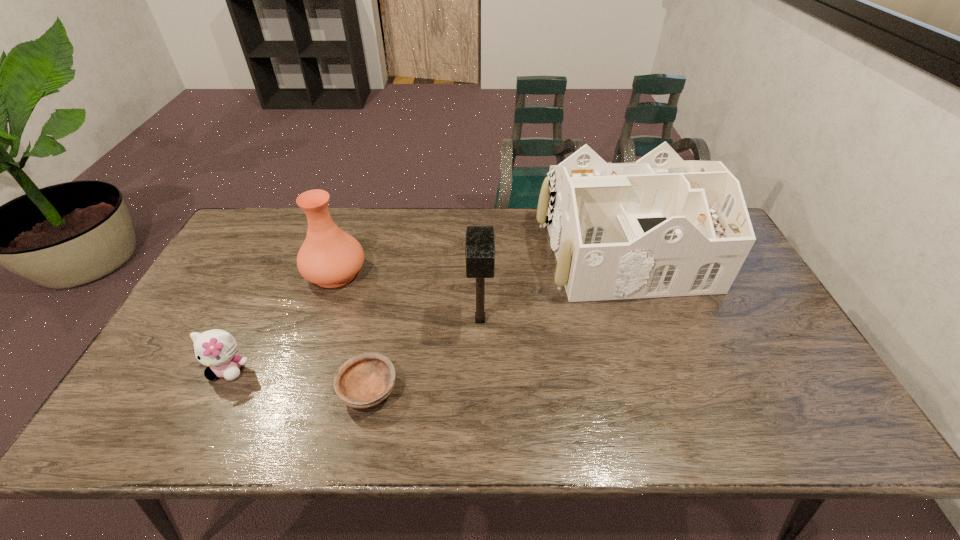
The image size is (960, 540). Identify the location of vacant space situated 0.140m on the back of the fourth object from right to left. (351, 225).

Identify the location of vacant space located on the front-facing side of the fourth tallest object. This screenshot has height=540, width=960. (192, 444).

The width and height of the screenshot is (960, 540). Identify the location of free space located on the right of the shortest object. (553, 390).

This screenshot has width=960, height=540. What are the coordinates of `object that is at the far edge` in the screenshot? It's located at coord(660,227).

This screenshot has height=540, width=960. I want to click on object present at the near edge, so click(x=365, y=380).

Identify the location of object located in the left edge section of the desktop. click(x=217, y=349).

Image resolution: width=960 pixels, height=540 pixels. In order to click on object that is at the right edge in this screenshot , I will do `click(660, 227)`.

The image size is (960, 540). I want to click on object that is at the far right corner, so click(660, 227).

I want to click on vacant region at the far edge of the desktop, so click(x=456, y=244).

Where is `free space at the near edge`? free space at the near edge is located at coordinates (626, 423).